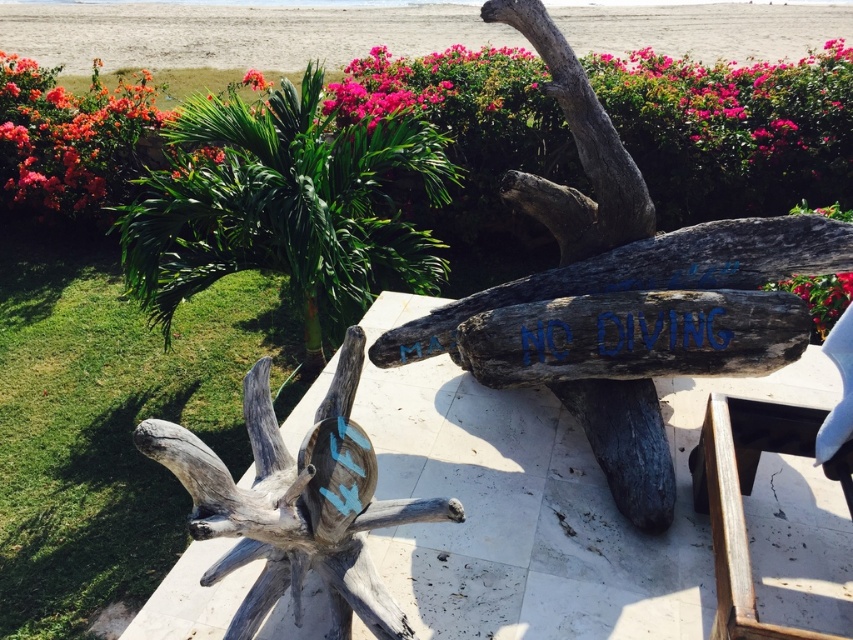
Consider the image. You are a park ranger inspecting the wooden sculpture. You need to determine which piece of wood is smaller in size between the gray rough wood log at center and the dark brown wood at upper center. Which one is smaller?

The gray rough wood log at center has a smaller size compared to the dark brown wood at upper center, so the gray rough wood log at center is the smaller one.

You are a park ranger inspecting the area around the gray rough wood log at center and the dark brown wood at upper center. From your vantage point, which object is located to the right of the other?

The gray rough wood log at center is positioned on the right side of dark brown wood at upper center, so the gray rough wood log at center is to the right of the dark brown wood at upper center.

You are standing in the serene outdoor setting near the beach and notice the dark brown wood at upper center and the vivid pink petals at upper center. Which object is located below the other?

The dark brown wood at upper center is positioned under the vivid pink petals at upper center, so the dark brown wood is below the petals.